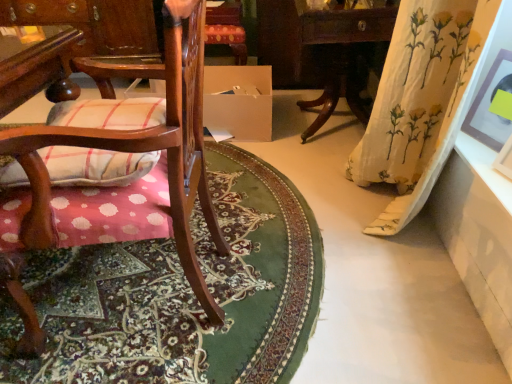
Question: Is wooden table at left, the third table viewed from the right, at the right side of wooden table at right, the 2th table from the front?

Choices:
 (A) no
 (B) yes

Answer: (A)

Question: Is wooden table at left, arranged as the third table when viewed from the front, oriented towards wooden table at right, acting as the 2th table starting from the back?

Choices:
 (A) yes
 (B) no

Answer: (B)

Question: Can you confirm if wooden table at left, arranged as the third table when viewed from the front, is smaller than wooden table at right, acting as the 2th table starting from the back?

Choices:
 (A) yes
 (B) no

Answer: (A)

Question: Is wooden table at left, the third table viewed from the right, not close to wooden table at right, acting as the 2th table starting from the back?

Choices:
 (A) no
 (B) yes

Answer: (B)

Question: From the image's perspective, is wooden table at left, the third table viewed from the right, under wooden table at right, the 2th table from the front?

Choices:
 (A) yes
 (B) no

Answer: (B)

Question: Considering their positions, is matte brown picture frame at upper right located in front of or behind wooden table at left, which is the first table from back to front?

Choices:
 (A) front
 (B) behind

Answer: (A)

Question: Based on their sizes in the image, would you say matte brown picture frame at upper right is bigger or smaller than wooden table at left, arranged as the 1th table when viewed from the left?

Choices:
 (A) big
 (B) small

Answer: (B)

Question: Is matte brown picture frame at upper right taller or shorter than wooden table at left, the third table viewed from the right?

Choices:
 (A) short
 (B) tall

Answer: (A)

Question: Which is correct: matte brown picture frame at upper right is inside wooden table at left, arranged as the third table when viewed from the front, or outside of it?

Choices:
 (A) outside
 (B) inside

Answer: (A)

Question: Is wooden table at right, acting as the 2th table starting from the back, wider or thinner than white glossy table at lower right, which is the 3th table in left-to-right order?

Choices:
 (A) wide
 (B) thin

Answer: (A)

Question: From their relative heights in the image, would you say wooden table at right, acting as the 2th table starting from the back, is taller or shorter than white glossy table at lower right, which is the 3th table in left-to-right order?

Choices:
 (A) tall
 (B) short

Answer: (A)

Question: Visually, is wooden table at right, the second table from the right, positioned to the left or to the right of white glossy table at lower right, the 1th table positioned from the right?

Choices:
 (A) left
 (B) right

Answer: (A)

Question: Is wooden table at right, acting as the 2th table starting from the back, inside or outside of white glossy table at lower right, which is the 3th table in left-to-right order?

Choices:
 (A) inside
 (B) outside

Answer: (B)

Question: Is wooden chair with cushion at left wider or thinner than plaid fabric cushion at left?

Choices:
 (A) thin
 (B) wide

Answer: (B)

Question: From their relative heights in the image, would you say wooden chair with cushion at left is taller or shorter than plaid fabric cushion at left?

Choices:
 (A) short
 (B) tall

Answer: (B)